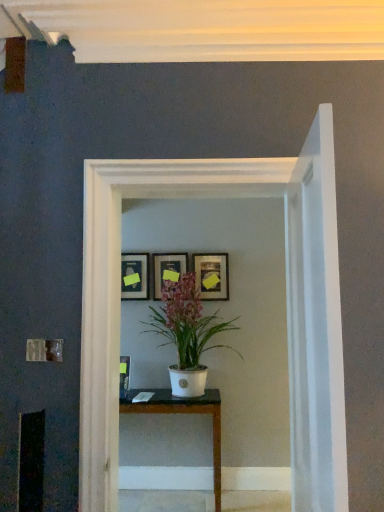
Question: Is matte black picture frame at upper center, marked as the third picture frame in a right-to-left arrangement, surrounding white glossy table at center?

Choices:
 (A) yes
 (B) no

Answer: (B)

Question: Can you confirm if matte black picture frame at upper center, positioned as the first picture frame in left-to-right order, is taller than white glossy table at center?

Choices:
 (A) no
 (B) yes

Answer: (A)

Question: Could you tell me if matte black picture frame at upper center, positioned as the first picture frame in left-to-right order, is turned towards white glossy table at center?

Choices:
 (A) yes
 (B) no

Answer: (B)

Question: Can you confirm if matte black picture frame at upper center, marked as the third picture frame in a right-to-left arrangement, is bigger than white glossy table at center?

Choices:
 (A) yes
 (B) no

Answer: (B)

Question: Is matte black picture frame at upper center, marked as the third picture frame in a right-to-left arrangement, looking in the opposite direction of white glossy table at center?

Choices:
 (A) yes
 (B) no

Answer: (B)

Question: Does matte black picture frame at upper center, positioned as the first picture frame in left-to-right order, come in front of white glossy table at center?

Choices:
 (A) yes
 (B) no

Answer: (B)

Question: Can you confirm if matte gold picture frame at center, acting as the third picture frame starting from the left, is thinner than white glossy glass door at center?

Choices:
 (A) yes
 (B) no

Answer: (A)

Question: Are matte gold picture frame at center, the first picture frame viewed from the right, and white glossy glass door at center far apart?

Choices:
 (A) yes
 (B) no

Answer: (A)

Question: From the image's perspective, is matte gold picture frame at center, the first picture frame viewed from the right, beneath white glossy glass door at center?

Choices:
 (A) no
 (B) yes

Answer: (A)

Question: Is matte gold picture frame at center, the first picture frame viewed from the right, directly adjacent to white glossy glass door at center?

Choices:
 (A) yes
 (B) no

Answer: (B)

Question: From the image's perspective, is matte gold picture frame at center, acting as the third picture frame starting from the left, over white glossy glass door at center?

Choices:
 (A) no
 (B) yes

Answer: (B)

Question: Is matte gold picture frame at center, the first picture frame viewed from the right, bigger than white glossy glass door at center?

Choices:
 (A) no
 (B) yes

Answer: (A)

Question: Considering the relative sizes of white glossy pot at center and white glossy glass door at center in the image provided, is white glossy pot at center wider than white glossy glass door at center?

Choices:
 (A) yes
 (B) no

Answer: (A)